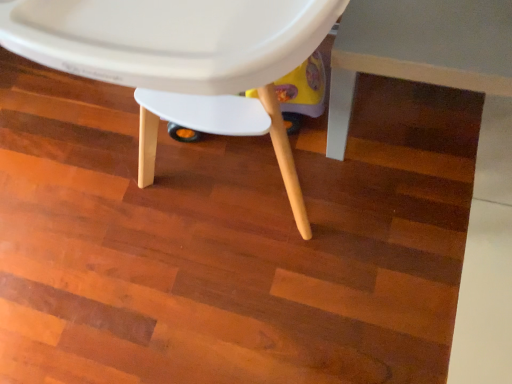
Describe the element at coordinates (181, 61) in the screenshot. This screenshot has width=512, height=384. I see `white matte plastic chair at center` at that location.

This screenshot has height=384, width=512. I want to click on white matte plastic chair at center, so click(x=181, y=61).

I want to click on white matte table at lower right, so click(x=419, y=50).

The image size is (512, 384). Describe the element at coordinates (419, 50) in the screenshot. I see `white matte table at lower right` at that location.

In order to click on white matte plastic chair at center in this screenshot , I will do `click(181, 61)`.

Does white matte table at lower right appear on the right side of white matte plastic chair at center?

Yes.

Which object is more forward, white matte table at lower right or white matte plastic chair at center?

white matte plastic chair at center is closer to the camera.

Considering the positions of points (349, 82) and (218, 111), is point (349, 82) closer to camera compared to point (218, 111)?

No, it is not.

From the image's perspective, is white matte table at lower right located beneath white matte plastic chair at center?

Indeed, from the image's perspective, white matte table at lower right is shown beneath white matte plastic chair at center.

From the picture: From a real-world perspective, who is located higher, white matte table at lower right or white matte plastic chair at center?

white matte plastic chair at center is physically above.

In terms of width, does white matte table at lower right look wider or thinner when compared to white matte plastic chair at center?

Considering their sizes, white matte table at lower right looks slimmer than white matte plastic chair at center.

Is white matte table at lower right shorter than white matte plastic chair at center?

Indeed, white matte table at lower right has a lesser height compared to white matte plastic chair at center.

Does white matte table at lower right have a smaller size compared to white matte plastic chair at center?

Correct, white matte table at lower right occupies less space than white matte plastic chair at center.

Is white matte table at lower right spatially inside white matte plastic chair at center, or outside of it?

white matte table at lower right is spatially situated outside white matte plastic chair at center.

Is white matte table at lower right next to white matte plastic chair at center and touching it?

No, white matte table at lower right is not with white matte plastic chair at center.

Is white matte table at lower right positioned with its back to white matte plastic chair at center?

No, white matte table at lower right is not facing the opposite direction of white matte plastic chair at center.

How different are the orientations of white matte table at lower right and white matte plastic chair at center in degrees?

1.36 degrees.

How far apart are white matte table at lower right and white matte plastic chair at center?

white matte table at lower right and white matte plastic chair at center are 14.89 inches apart from each other.

Where is `chair located on the left of white matte table at lower right`? The width and height of the screenshot is (512, 384). chair located on the left of white matte table at lower right is located at coordinates (181, 61).

In the scene shown: Is white matte plastic chair at center to the right of white matte table at lower right from the viewer's perspective?

Incorrect, white matte plastic chair at center is not on the right side of white matte table at lower right.

In the scene shown: Which object is more forward, white matte plastic chair at center or white matte table at lower right?

white matte plastic chair at center is in front.

Which is in front, point (153, 68) or point (412, 4)?

Positioned in front is point (153, 68).

From the image's perspective, relative to white matte table at lower right, is white matte plastic chair at center above or below?

From the image's perspective, white matte plastic chair at center appears above white matte table at lower right.

From a real-world perspective, who is located lower, white matte plastic chair at center or white matte table at lower right?

white matte table at lower right, from a real-world perspective.

Which object is wider, white matte plastic chair at center or white matte table at lower right?

With larger width is white matte plastic chair at center.

Can you confirm if white matte plastic chair at center is taller than white matte table at lower right?

Yes, white matte plastic chair at center is taller than white matte table at lower right.

Considering the relative sizes of white matte plastic chair at center and white matte table at lower right in the image provided, is white matte plastic chair at center smaller than white matte table at lower right?

Incorrect, white matte plastic chair at center is not smaller in size than white matte table at lower right.

In the scene shown: Is white matte plastic chair at center situated inside white matte table at lower right or outside?

white matte plastic chair at center is outside white matte table at lower right.

Are white matte plastic chair at center and white matte table at lower right located far from each other?

No, white matte plastic chair at center is not far away from white matte table at lower right.

Could you tell me if white matte plastic chair at center is turned towards white matte table at lower right?

No, white matte plastic chair at center is not aimed at white matte table at lower right.

Where is `chair in front of the white matte table at lower right`? chair in front of the white matte table at lower right is located at coordinates (181, 61).

The image size is (512, 384). Identify the location of chair lying on the left of white matte table at lower right. (x=181, y=61).

In the image, there is a white matte plastic chair at center. Identify the location of table below it (from a real-world perspective). (419, 50).